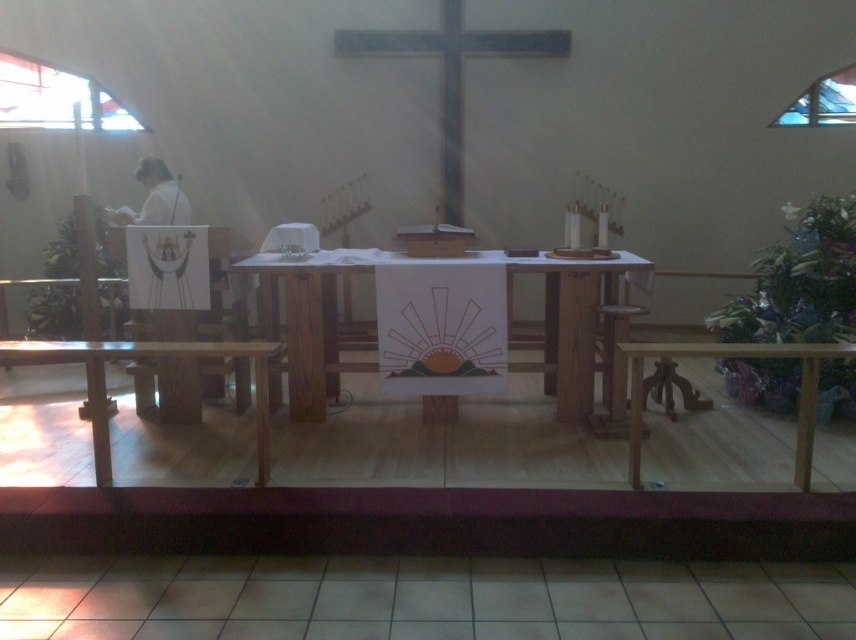
Can you confirm if wooden table at lower left is positioned above wooden stool at center?

No, wooden table at lower left is not above wooden stool at center.

Is wooden table at lower left below wooden stool at center?

Indeed, wooden table at lower left is positioned under wooden stool at center.

Who is more distant from viewer, (262, 397) or (607, 326)?

The point (607, 326) is more distant.

Where is `wooden table at lower left`? This screenshot has width=856, height=640. wooden table at lower left is located at coordinates (146, 356).

Is wooden cross at center above wooden table at lower right?

Yes, wooden cross at center is above wooden table at lower right.

Locate an element on the screen. The image size is (856, 640). wooden cross at center is located at coordinates pos(450,76).

Where is `wooden cross at center`? Image resolution: width=856 pixels, height=640 pixels. wooden cross at center is located at coordinates pyautogui.click(x=450, y=76).

At what (x,y) coordinates should I click in order to perform the action: click on wooden table at center. Please return your answer as a coordinate pair (x, y). Looking at the image, I should click on (569, 324).

Does wooden table at center have a lesser width compared to wooden table at lower right?

Yes.

Image resolution: width=856 pixels, height=640 pixels. What are the coordinates of `wooden table at center` in the screenshot? It's located at (569, 324).